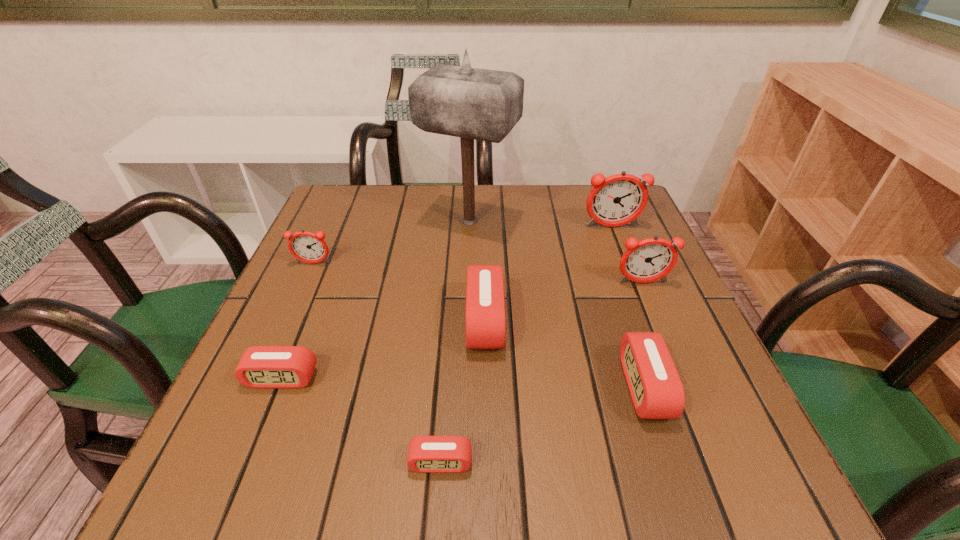
Image resolution: width=960 pixels, height=540 pixels. What are the coordinates of `the tallest object` in the screenshot? It's located at (475, 104).

Locate an element on the screen. This screenshot has height=540, width=960. the farthest reddish-pink alarm clock is located at coordinates (619, 199).

Where is `the biggest reddish-pink alarm clock`? the biggest reddish-pink alarm clock is located at coordinates (619, 199).

Where is `the nearest reddish-pink alarm clock`? This screenshot has width=960, height=540. the nearest reddish-pink alarm clock is located at coordinates (652, 259).

Find the location of a particular element. The height and width of the screenshot is (540, 960). the sixth shortest object is located at coordinates (652, 259).

Where is `the second farthest reddish-pink alarm clock`? This screenshot has height=540, width=960. the second farthest reddish-pink alarm clock is located at coordinates pyautogui.click(x=307, y=247).

Identify the location of the sixth nearest object. (307, 247).

Where is `the biggest pink alarm clock`? the biggest pink alarm clock is located at coordinates (485, 306).

Find the location of a particular element. the third smallest pink alarm clock is located at coordinates (655, 387).

At what (x,y) coordinates should I click in order to perform the action: click on the rightmost pink alarm clock. Please return your answer as a coordinate pair (x, y). This screenshot has height=540, width=960. Looking at the image, I should click on (655, 387).